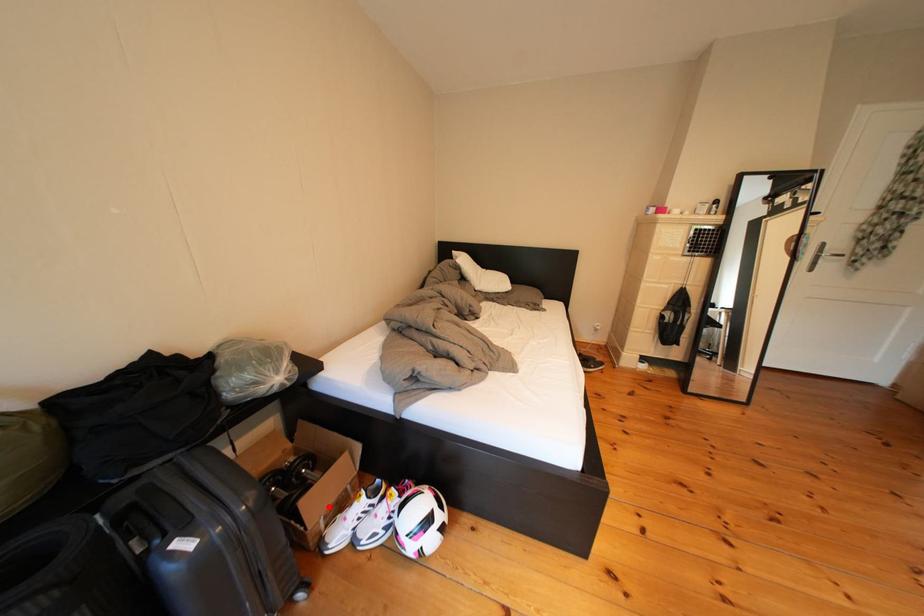
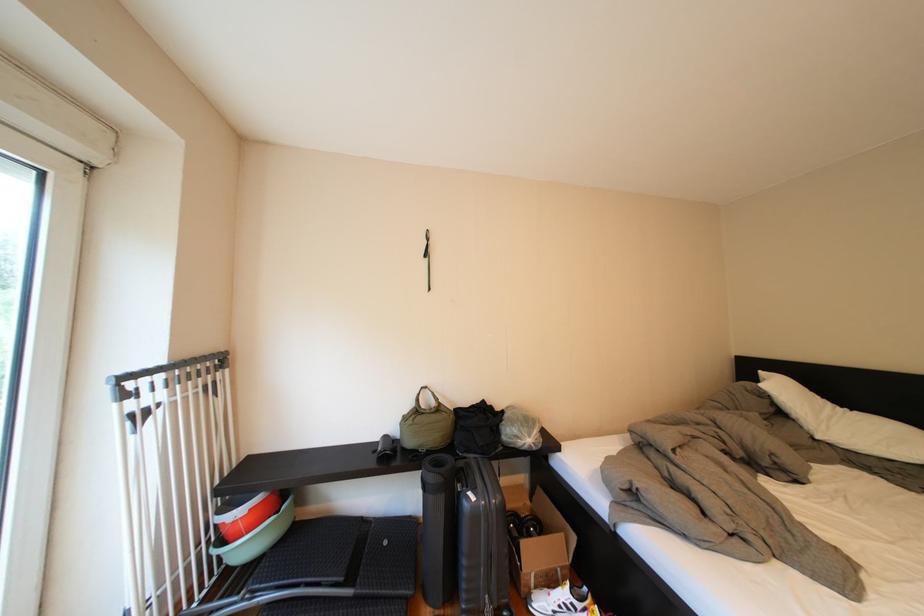
Question: I am providing you with two images of the same scene from different viewpoints. A red point is shown in image1. For the corresponding object point in image2, is it positioned nearer or farther from the camera?

Choices:
 (A) Nearer
 (B) Farther

Answer: (B)